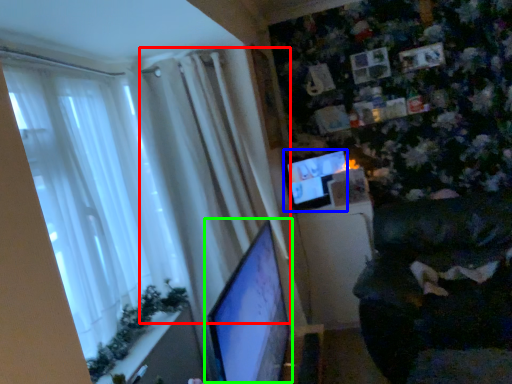
Question: Considering the real-world distances, which object is farthest from curtain (highlighted by a red box)? computer monitor (highlighted by a blue box) or computer monitor (highlighted by a green box)?

Choices:
 (A) computer monitor
 (B) computer monitor

Answer: (A)